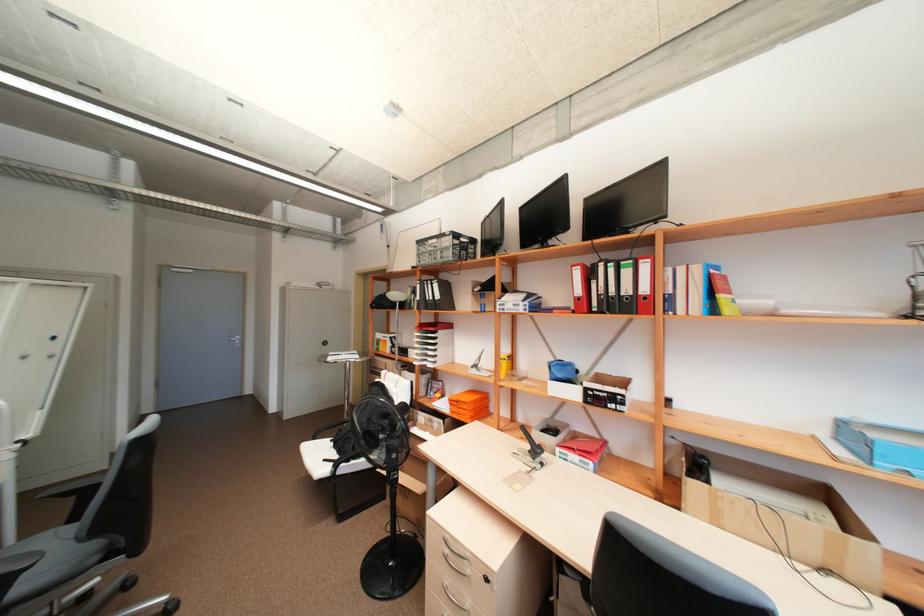
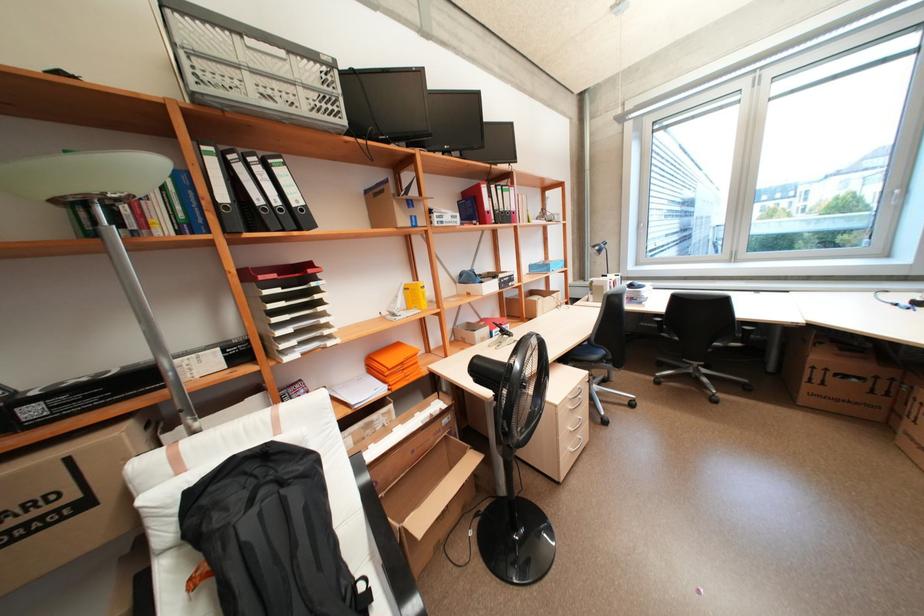
The point at (578, 448) is marked in the first image. Where is the corresponding point in the second image?

(505, 323)